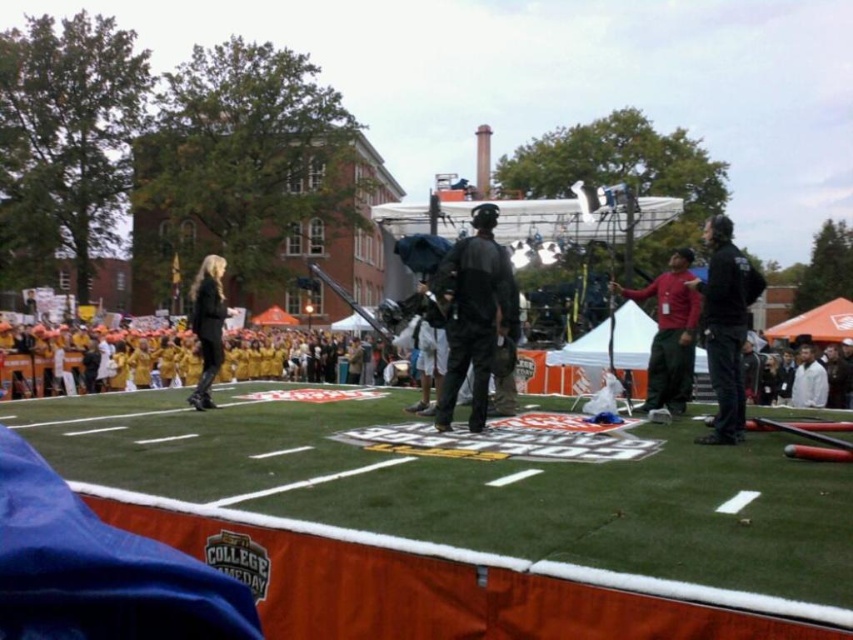
Question: Which of the following is the farthest from the observer?

Choices:
 (A) green artificial turf at center
 (B) yellow fabric at center

Answer: (B)

Question: Does dark gray fabric jacket at center appear over white matte jacket at right?

Choices:
 (A) yes
 (B) no

Answer: (A)

Question: Which point appears closest to the camera in this image?

Choices:
 (A) (712, 376)
 (B) (207, 385)
 (C) (447, 257)
 (D) (814, 401)

Answer: (A)

Question: In this image, where is yellow fabric at center located relative to black matte jacket at upper right?

Choices:
 (A) right
 (B) left

Answer: (B)

Question: Which of the following is the closest to the observer?

Choices:
 (A) (456, 346)
 (B) (712, 365)

Answer: (B)

Question: Does black leather jacket at center appear on the left side of white matte jacket at right?

Choices:
 (A) no
 (B) yes

Answer: (B)